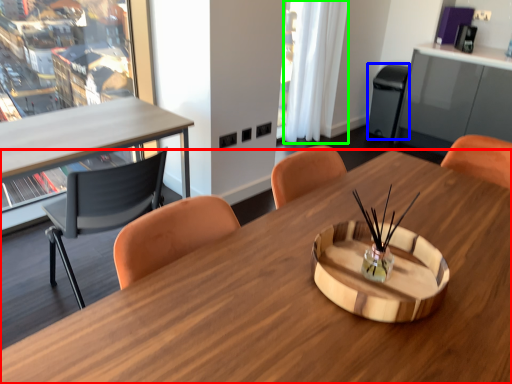
Question: Considering the real-world distances, which object is farthest from desk (highlighted by a red box)? trash bin/can (highlighted by a blue box) or curtain (highlighted by a green box)?

Choices:
 (A) trash bin/can
 (B) curtain

Answer: (A)